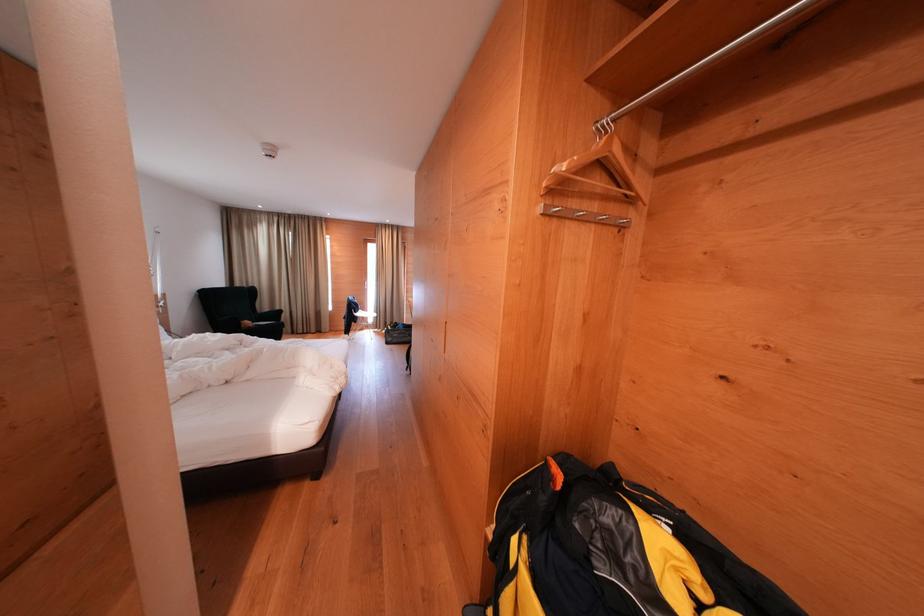
Find where to hang the metal closet rod. Please return your answer as a coordinate pair (x, y).

(704, 63)